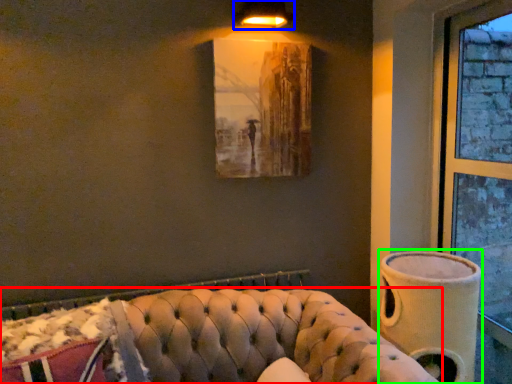
Question: Estimate the real-world distances between objects in this image. Which object is closer to studio couch (highlighted by a red box), lamp (highlighted by a blue box) or vase (highlighted by a green box)?

Choices:
 (A) lamp
 (B) vase

Answer: (B)